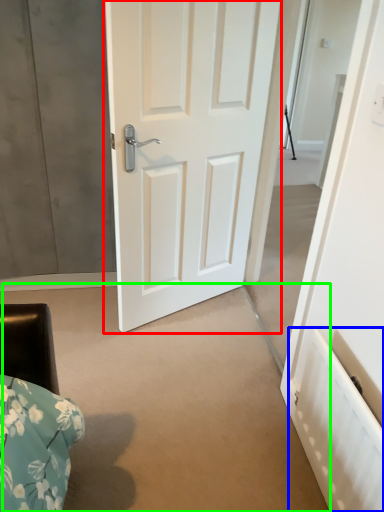
Question: Which object is the farthest from door (highlighted by a red box)? Choose among these: radiator (highlighted by a blue box) or concrete (highlighted by a green box).

Choices:
 (A) radiator
 (B) concrete

Answer: (A)